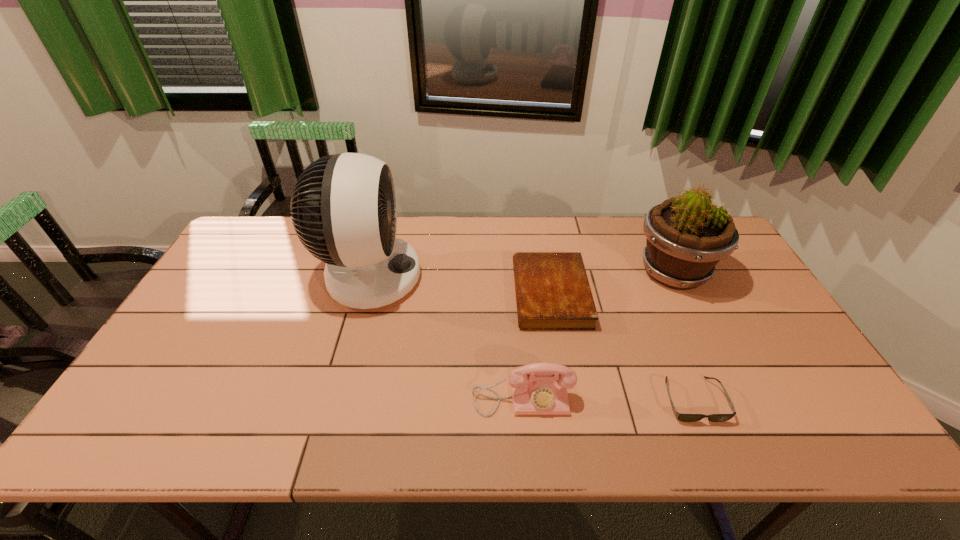
Where is `vacant space at the right edge`? The height and width of the screenshot is (540, 960). vacant space at the right edge is located at coordinates (814, 398).

This screenshot has height=540, width=960. I want to click on free space at the far left corner of the desktop, so pos(243,233).

At what (x,y) coordinates should I click in order to perform the action: click on vacant region at the near right corner. Please return your answer as a coordinate pair (x, y). The height and width of the screenshot is (540, 960). Looking at the image, I should click on (831, 448).

Find the location of a particular element. free space between the sunglasses and the telephone is located at coordinates (608, 399).

Locate an element on the screen. unoccupied position between the fan and the second shortest object is located at coordinates (460, 286).

The width and height of the screenshot is (960, 540). Identify the location of vacant space that is in between the fan and the Bible. (460, 286).

Identify the location of blank region between the third shortest object and the leftmost object. The height and width of the screenshot is (540, 960). (445, 338).

Where is `free spot between the third tallest object and the second shortest object`? free spot between the third tallest object and the second shortest object is located at coordinates (537, 346).

What are the coordinates of `blank region between the shortest object and the flowerpot` in the screenshot? It's located at (684, 336).

Locate an element on the screen. This screenshot has width=960, height=540. empty space that is in between the shortest object and the flowerpot is located at coordinates (684, 336).